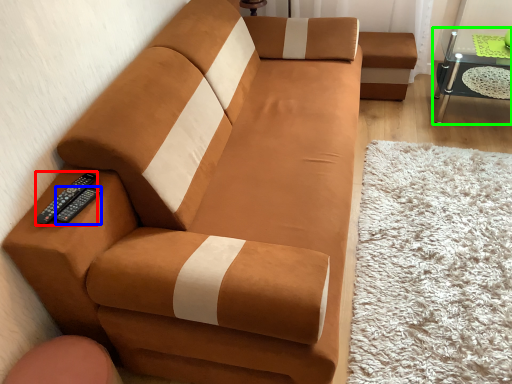
Question: Based on their relative distances, which object is nearer to remote (highlighted by a red box)? Choose from remote (highlighted by a blue box) and table (highlighted by a green box).

Choices:
 (A) remote
 (B) table

Answer: (A)